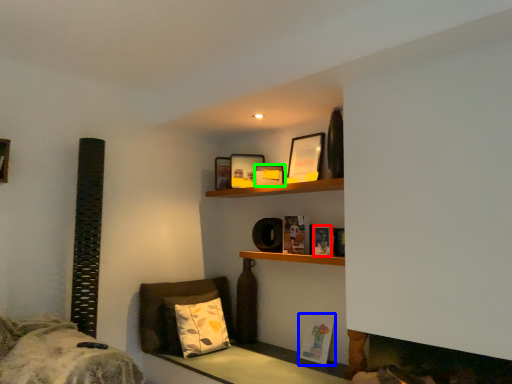
Question: Which object is the closest to the book (highlighted by a red box)? Choose among these: book (highlighted by a blue box) or picture frame (highlighted by a green box).

Choices:
 (A) book
 (B) picture frame

Answer: (B)